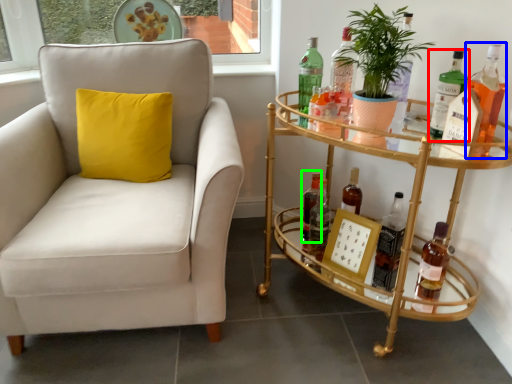
Question: Which object is the farthest from bottle (highlighted by a red box)? Choose among these: bottle (highlighted by a blue box) or bottle (highlighted by a green box).

Choices:
 (A) bottle
 (B) bottle

Answer: (B)